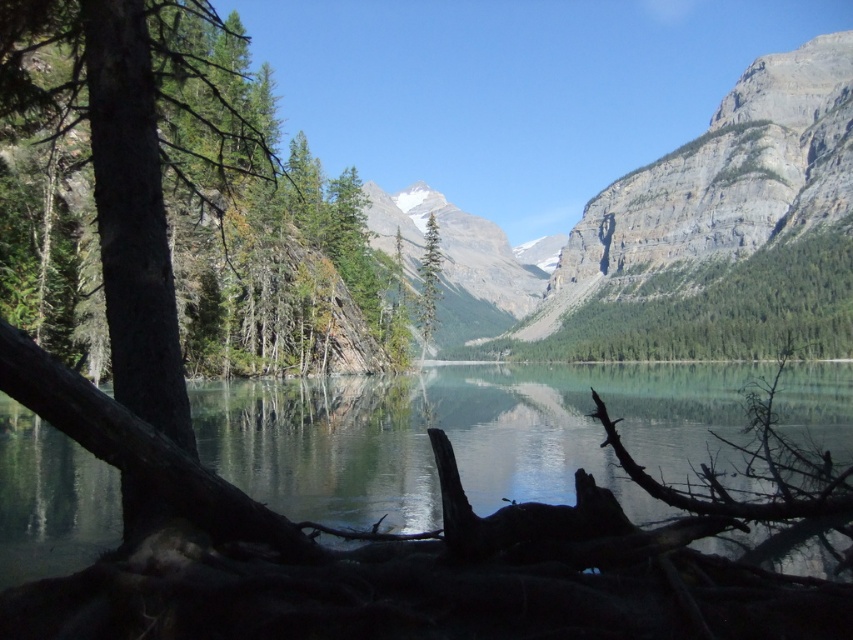
Locate an element on the screen. clear glass water at center is located at coordinates (466, 435).

From the picture: Can you confirm if clear glass water at center is shorter than white snow-covered mountain at center?

Indeed, clear glass water at center has a lesser height compared to white snow-covered mountain at center.

This screenshot has height=640, width=853. I want to click on clear glass water at center, so click(x=466, y=435).

Identify the location of clear glass water at center. (466, 435).

Is white snow-covered mountain at center positioned before green matte tree at center?

That is False.

Is point (524, 296) positioned before point (434, 323)?

No, (524, 296) is further to viewer.

Which is behind, point (399, 202) or point (422, 317)?

Point (399, 202)

You are a GUI agent. You are given a task and a screenshot of the screen. Output one action in this format:
    pyautogui.click(x=<x>, y=<y>)
    Task: Click on the white snow-covered mountain at center
    Image resolution: width=853 pixels, height=640 pixels.
    Given the screenshot: What is the action you would take?
    pyautogui.click(x=456, y=250)

Who is taller, clear glass water at center or green matte tree at center?

green matte tree at center

Which is more to the right, clear glass water at center or green matte tree at center?

From the viewer's perspective, clear glass water at center appears more on the right side.

Consider the image. Who is more distant from viewer, (61, 531) or (428, 289)?

Positioned behind is point (428, 289).

Find the location of a particular element. clear glass water at center is located at coordinates (466, 435).